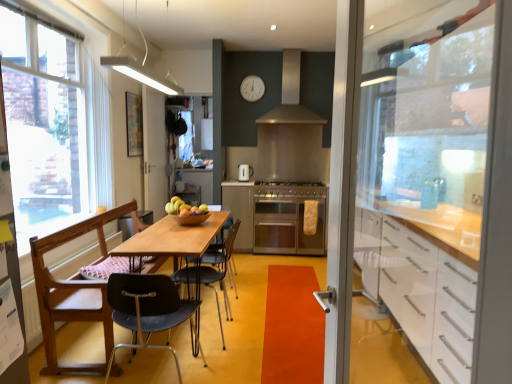
Where is `vacant space that's between black plastic chair at center, the third chair in the front-to-back sequence, and wooden table at center`? vacant space that's between black plastic chair at center, the third chair in the front-to-back sequence, and wooden table at center is located at coordinates (229, 312).